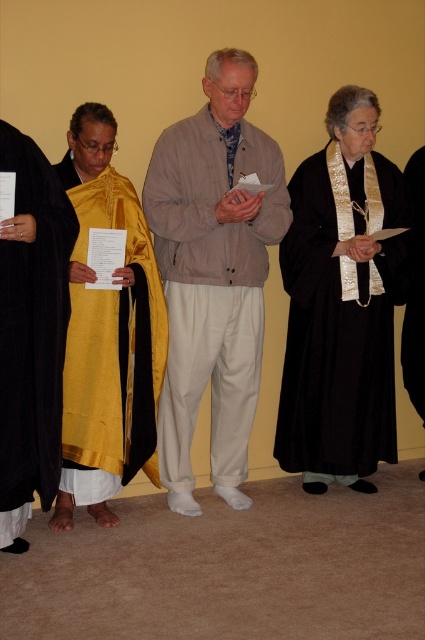
You are a costume designer observing the image. You need to determine which robe is shorter between the golden silk robe at left and the black matte robe at left for a scene requiring shorter attire. Which one should you choose?

The golden silk robe at left is shorter than the black matte robe at left, so you should choose the golden silk robe at left for the scene requiring shorter attire.

You are an interior designer measuring the space between two black robes displayed on the right side of the image. The minimum clearance required between displayed items is 15 inches. Can the black velvet robe at right and the black silk robe at right be placed as shown without violating the clearance rule?

The black velvet robe at right is 14.96 inches from the black silk robe at right. Since 14.96 inches is less than the required 15 inches clearance, placing them as shown would violate the clearance rule.